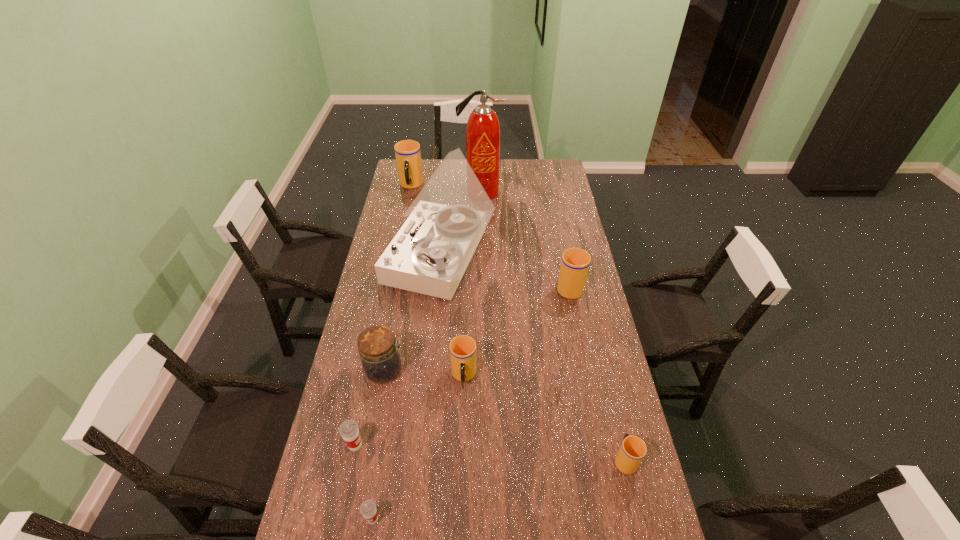
Where is `vacant space located 0.260m on the side of the third smallest beige cup with the handle`? This screenshot has height=540, width=960. vacant space located 0.260m on the side of the third smallest beige cup with the handle is located at coordinates (559, 234).

At what (x,y) coordinates should I click in order to perform the action: click on vacant space located on the side of the third smallest beige cup with the handle. Please return your answer as a coordinate pair (x, y). Looking at the image, I should click on (555, 217).

You are a GUI agent. You are given a task and a screenshot of the screen. Output one action in this format:
    pyautogui.click(x=<x>, y=<y>)
    Task: Click on the free location located 0.110m on the lid of the jar
    
    Given the screenshot: What is the action you would take?
    pyautogui.click(x=439, y=370)

The height and width of the screenshot is (540, 960). In order to click on vacant space situated on the side of the farther red cup with the logo in this screenshot , I will do `click(428, 446)`.

You are a GUI agent. You are given a task and a screenshot of the screen. Output one action in this format:
    pyautogui.click(x=<x>, y=<y>)
    Task: Click on the vacant area situated on the side of the third farthest beige cup with the handle
    Image resolution: width=960 pixels, height=540 pixels.
    Given the screenshot: What is the action you would take?
    pyautogui.click(x=463, y=423)

The height and width of the screenshot is (540, 960). Find the location of `blank space located 0.060m on the side of the smallest beige cup with the handle`. blank space located 0.060m on the side of the smallest beige cup with the handle is located at coordinates (617, 425).

What are the coordinates of `blank space located on the side of the smallest beige cup with the handle` in the screenshot? It's located at (608, 388).

Image resolution: width=960 pixels, height=540 pixels. In order to click on vacant area located 0.080m on the side of the smallest beige cup with the handle in this screenshot , I will do `click(615, 419)`.

You are a GUI agent. You are given a task and a screenshot of the screen. Output one action in this format:
    pyautogui.click(x=<x>, y=<y>)
    Task: Click on the object present at the far edge
    This screenshot has width=960, height=540.
    Given the screenshot: What is the action you would take?
    click(x=407, y=152)

The image size is (960, 540). I want to click on record player present at the left edge, so click(x=430, y=253).